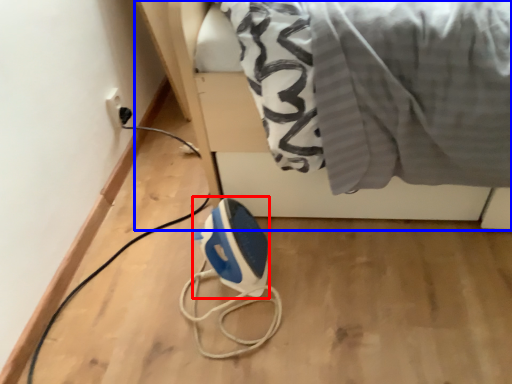
Question: Which point is closer to the camera, appliance (highlighted by a red box) or furniture (highlighted by a blue box)?

Choices:
 (A) appliance
 (B) furniture

Answer: (B)